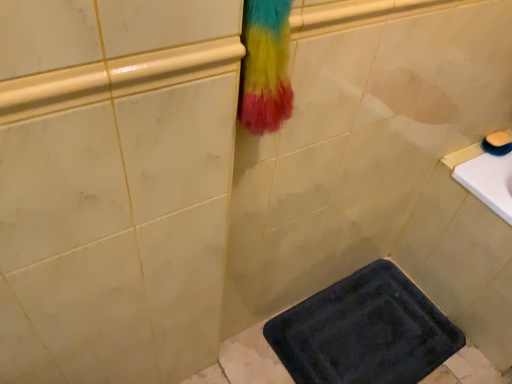
Question: Is point (431, 345) positioned closer to the camera than point (501, 145)?

Choices:
 (A) closer
 (B) farther

Answer: (B)

Question: Considering the positions of dark blue textured bath mat at lower center and smooth yellow soap at upper right in the image, is dark blue textured bath mat at lower center taller or shorter than smooth yellow soap at upper right?

Choices:
 (A) short
 (B) tall

Answer: (A)

Question: Looking at the image, does dark blue textured bath mat at lower center seem bigger or smaller compared to smooth yellow soap at upper right?

Choices:
 (A) small
 (B) big

Answer: (B)

Question: From a real-world perspective, relative to dark blue textured bath mat at lower center, is smooth yellow soap at upper right vertically above or below?

Choices:
 (A) below
 (B) above

Answer: (B)

Question: Is smooth yellow soap at upper right bigger or smaller than dark blue textured bath mat at lower center?

Choices:
 (A) big
 (B) small

Answer: (B)

Question: In terms of width, does smooth yellow soap at upper right look wider or thinner when compared to dark blue textured bath mat at lower center?

Choices:
 (A) wide
 (B) thin

Answer: (B)

Question: Visually, is smooth yellow soap at upper right positioned to the left or to the right of dark blue textured bath mat at lower center?

Choices:
 (A) left
 (B) right

Answer: (B)